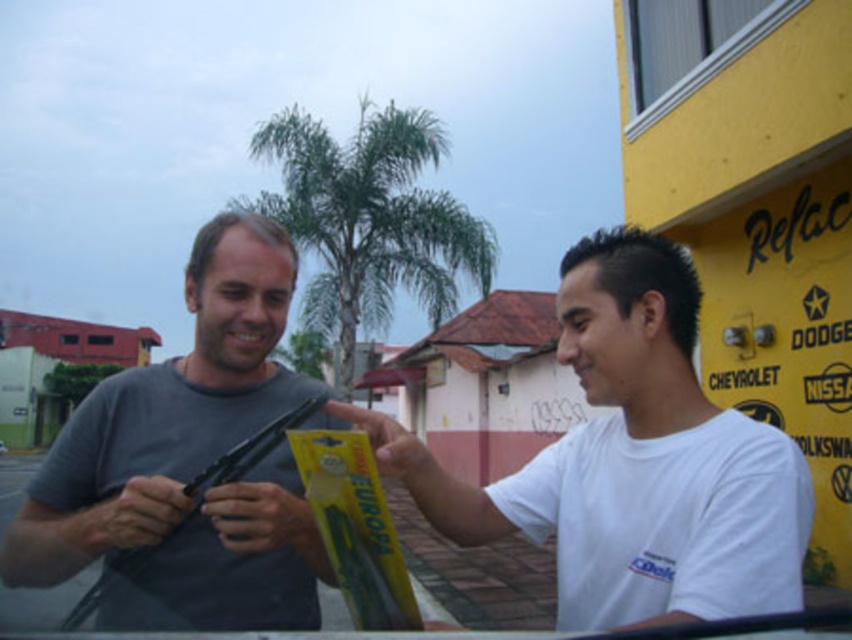
You are standing in front of the yellow building with car brand signs. There are two points marked in the image. Which point is closer to you, point (260, 388) or point (373, 616)?

Point (260, 388) is closer to you than point (373, 616) because it is further to the viewer.

You are a customer at a car parts store. You see the white matte shirt at center and the yellow plastic package at center. Which item is bigger?

The white matte shirt at center is larger in size than the yellow plastic package at center.

Based on the photo, you are standing in front of the car repair shop and see two people wearing white matte shirt at center and matte gray shirt at center. Which person is standing closer to the building?

The white matte shirt at center is located above matte gray shirt at center, so the person wearing the white matte shirt at center is standing closer to the building.